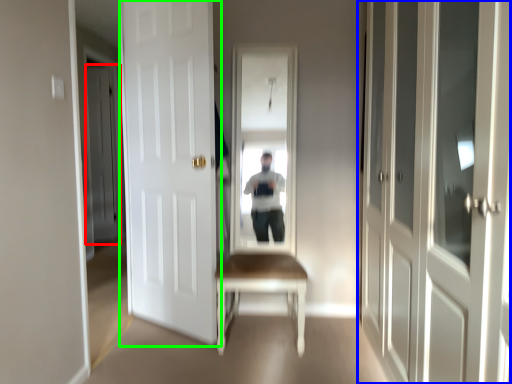
Question: Considering the real-world distances, which object is closest to door (highlighted by a red box)? door (highlighted by a blue box) or door (highlighted by a green box).

Choices:
 (A) door
 (B) door

Answer: (B)